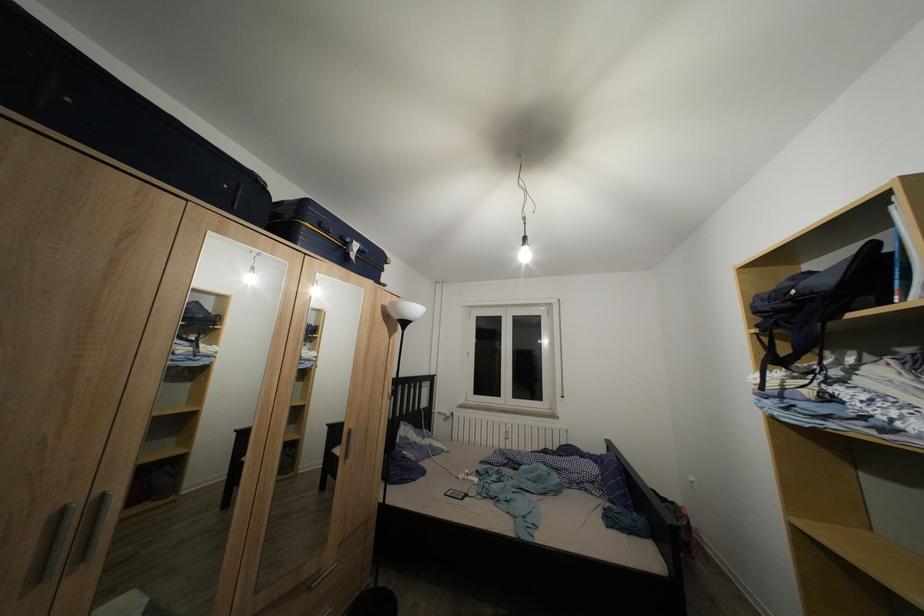
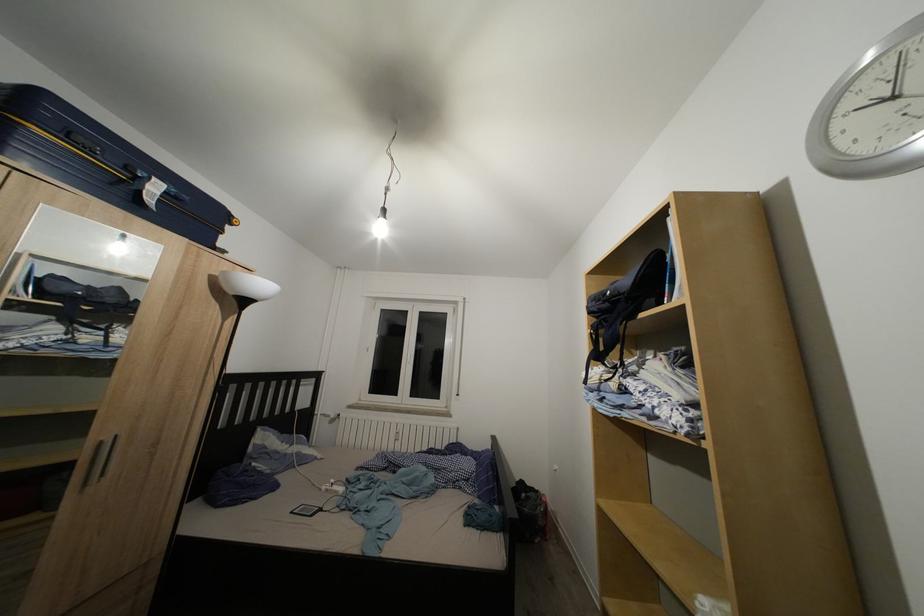
Question: How did the camera likely rotate?

Choices:
 (A) Left
 (B) Right
 (C) Up
 (D) Down

Answer: (B)